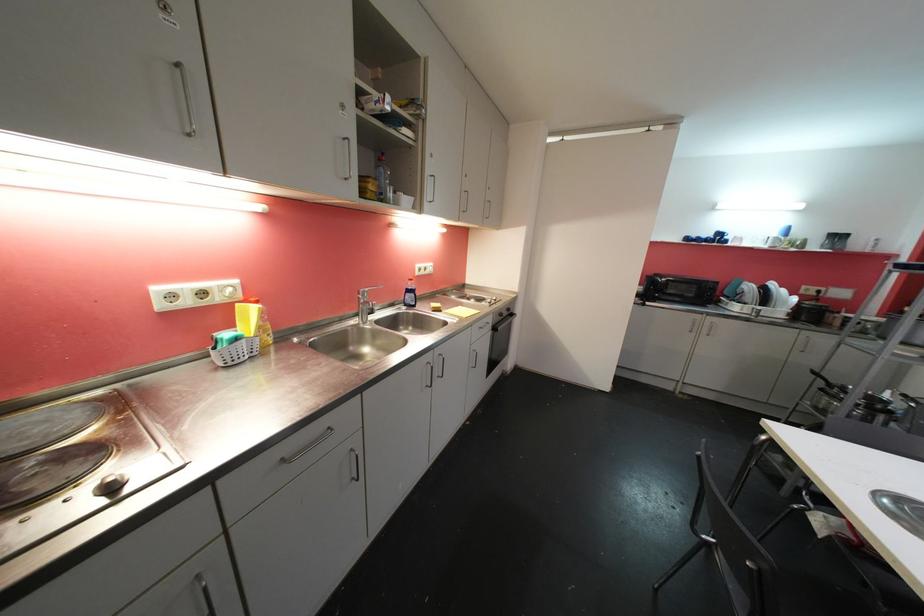
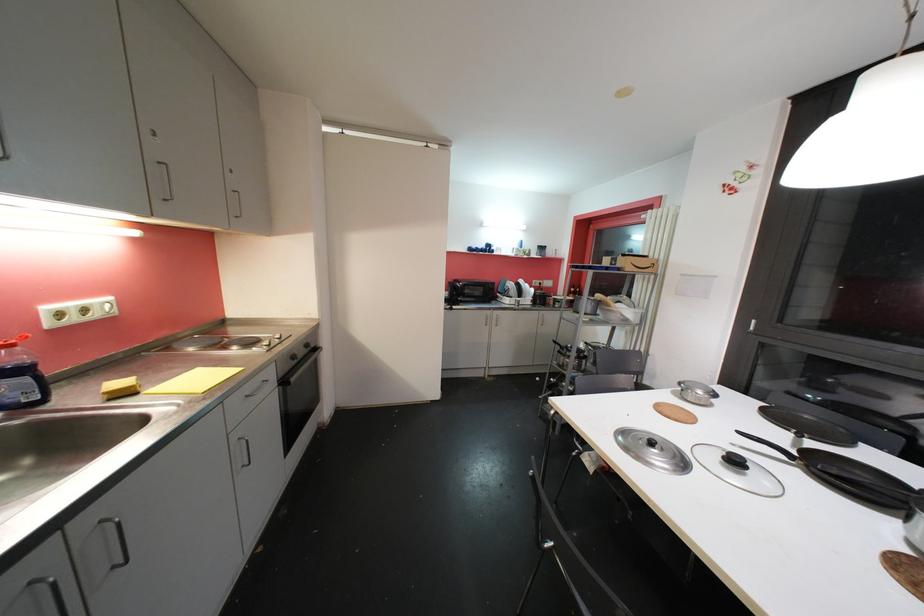
Question: Based on the continuous images, in which direction is the camera rotating? Reply with the corresponding letter.

Choices:
 (A) Left
 (B) Right
 (C) Up
 (D) Down

Answer: (B)